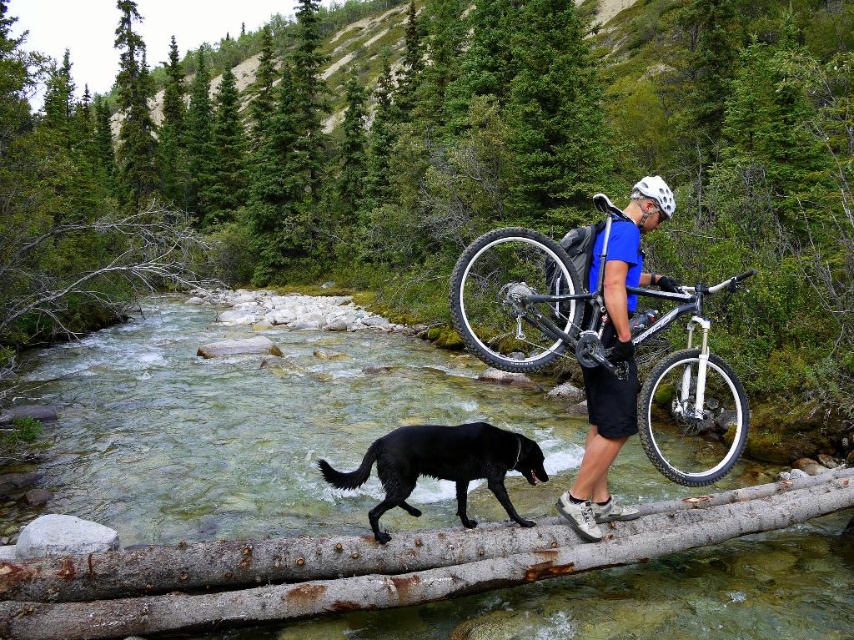
Question: From the image, what is the correct spatial relationship of black rubber bicycle wheel at center in relation to white rubber tire at center?

Choices:
 (A) above
 (B) below

Answer: (A)

Question: Which of the following is the farthest from the observer?

Choices:
 (A) (463, 253)
 (B) (615, 253)
 (C) (499, 545)
 (D) (376, 472)

Answer: (D)

Question: Which object is positioned closest to the clear water at log center?

Choices:
 (A) white rubber tire at center
 (B) silver metallic bicycle at center
 (C) rusty wood log at center
 (D) black rubber bicycle wheel at center

Answer: (B)

Question: Which object appears closest to the camera in this image?

Choices:
 (A) white rubber tire at center
 (B) clear water at log center

Answer: (B)

Question: Does clear water at log center come in front of blue fabric shirt at center?

Choices:
 (A) yes
 (B) no

Answer: (A)

Question: Can you confirm if silver metallic bicycle at center is thinner than white rubber tire at center?

Choices:
 (A) no
 (B) yes

Answer: (A)